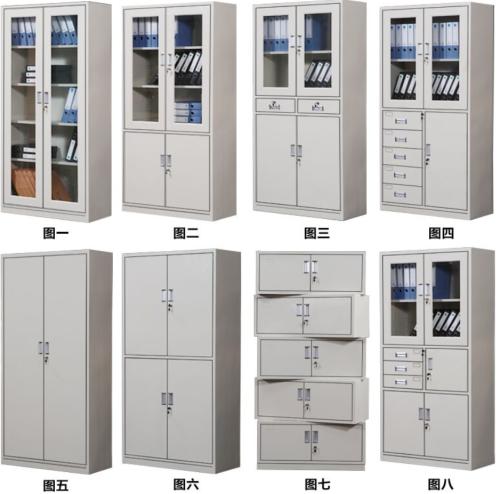
You are a GUI agent. You are given a task and a screenshot of the screen. Output one action in this format:
    pyautogui.click(x=<x>, y=<y>)
    Task: Click on the staggered 5 drawer cabinet to right of center
    The width and height of the screenshot is (500, 494).
    Given the screenshot: What is the action you would take?
    pyautogui.click(x=327, y=375)